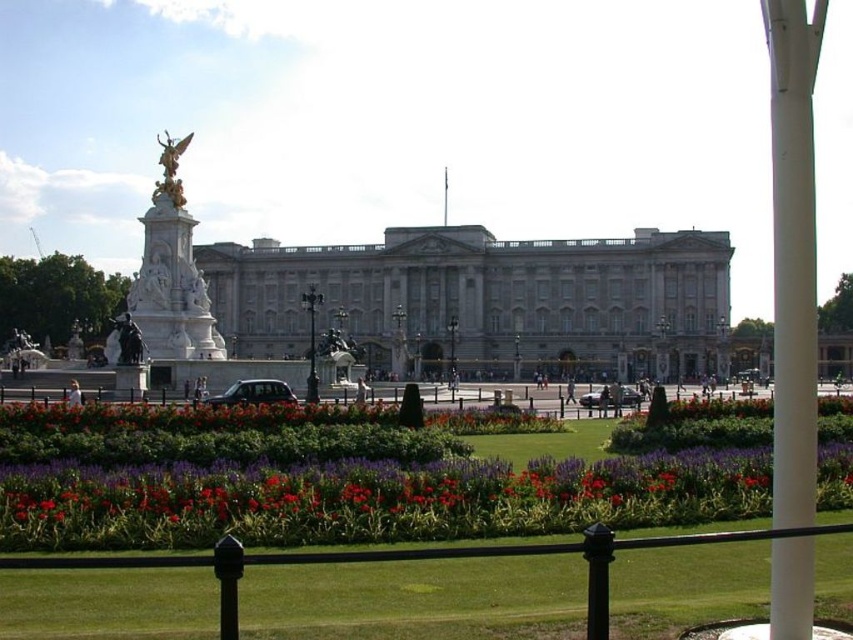
You are a visitor standing in the garden of the Buckingham Palace. You see the black metal fence at lower center and the gold polished statue at upper left. Which object is closer to you?

The black metal fence at lower center is closer to you as it is positioned in front of the gold polished statue at upper left.